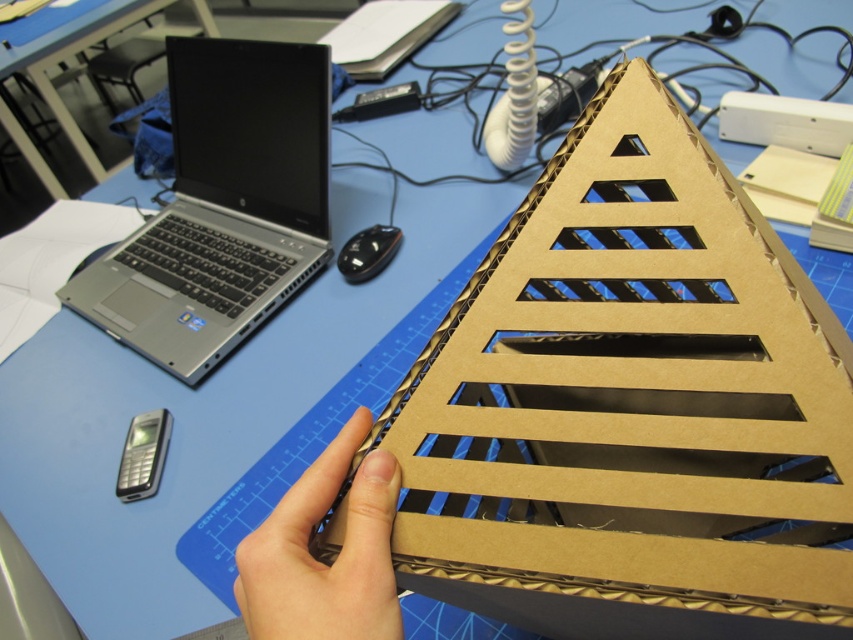
Can you confirm if silver/black plastic laptop at upper left is smaller than brown cardboard hand at center?

Incorrect, silver/black plastic laptop at upper left is not smaller in size than brown cardboard hand at center.

The height and width of the screenshot is (640, 853). What are the coordinates of `silver/black plastic laptop at upper left` in the screenshot? It's located at (222, 205).

Locate an element on the screen. The width and height of the screenshot is (853, 640). silver/black plastic laptop at upper left is located at coordinates (222, 205).